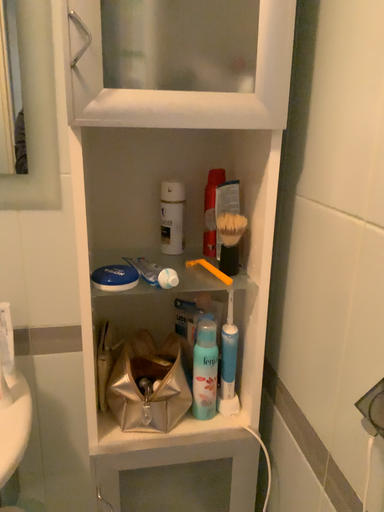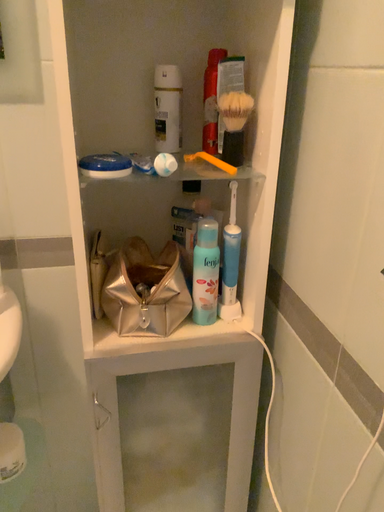
Question: How did the camera likely rotate when shooting the video?

Choices:
 (A) rotated downward
 (B) rotated upward

Answer: (A)